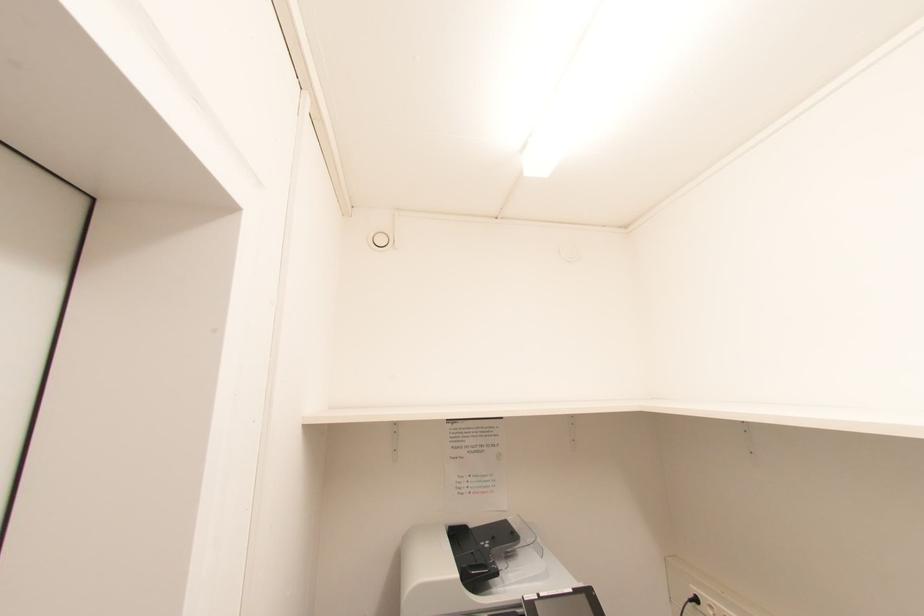
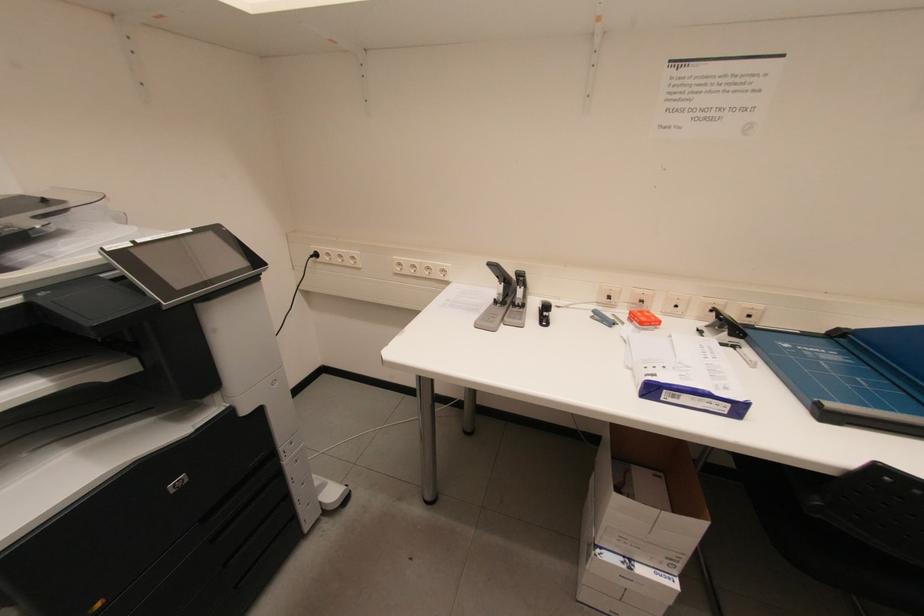
The first image is from the beginning of the video and the second image is from the end. How did the camera likely rotate when shooting the video?

The camera rotated toward right-down.